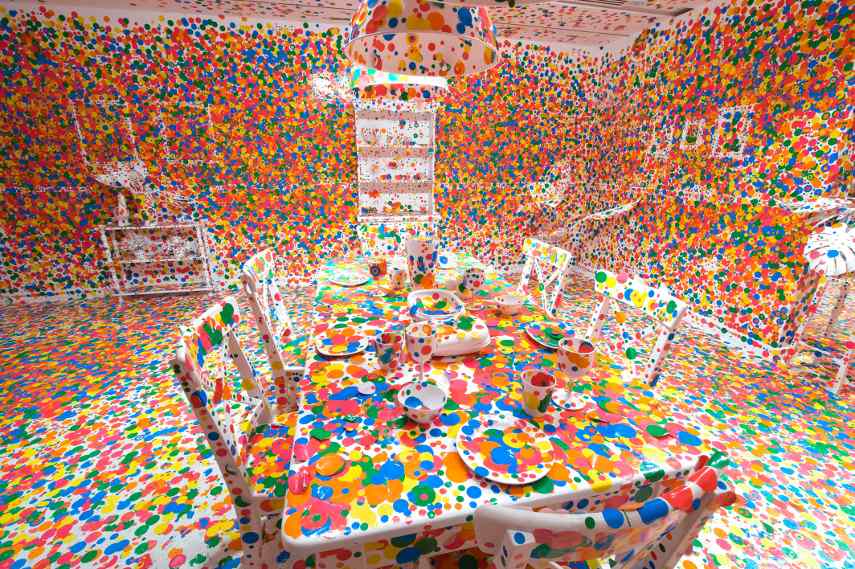
Locate an element on the screen. The height and width of the screenshot is (569, 855). floor is located at coordinates (x=797, y=498).